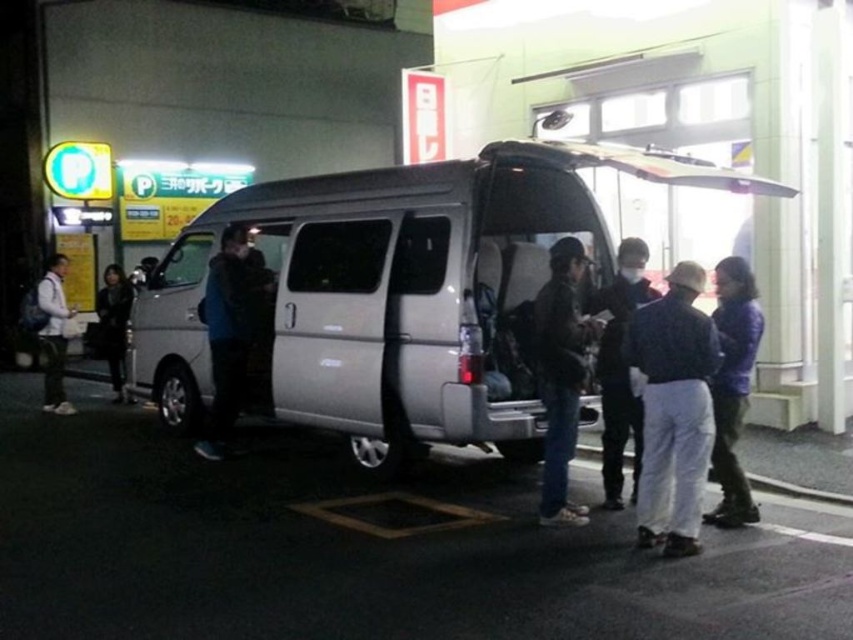
Can you confirm if denim jacket at center is bigger than dark blue jacket at left?

No, denim jacket at center is not bigger than dark blue jacket at left.

Can you confirm if denim jacket at center is smaller than dark blue jacket at left?

Indeed, denim jacket at center has a smaller size compared to dark blue jacket at left.

Describe the element at coordinates (560, 374) in the screenshot. I see `denim jacket at center` at that location.

Find the location of `denim jacket at center`. denim jacket at center is located at coordinates (560, 374).

Does silver metallic van at center appear on the right side of leather jacket at left?

Yes, silver metallic van at center is to the right of leather jacket at left.

Who is taller, silver metallic van at center or leather jacket at left?

With more height is silver metallic van at center.

Who is more forward, (534, 401) or (115, 368)?

Point (534, 401) is more forward.

This screenshot has width=853, height=640. In order to click on silver metallic van at center in this screenshot , I will do `click(396, 294)`.

Is dark blue jacket at center taller than leather jacket at left?

Yes, dark blue jacket at center is taller than leather jacket at left.

Is dark blue jacket at center above leather jacket at left?

Actually, dark blue jacket at center is below leather jacket at left.

Find the location of a particular element. The image size is (853, 640). dark blue jacket at center is located at coordinates (619, 369).